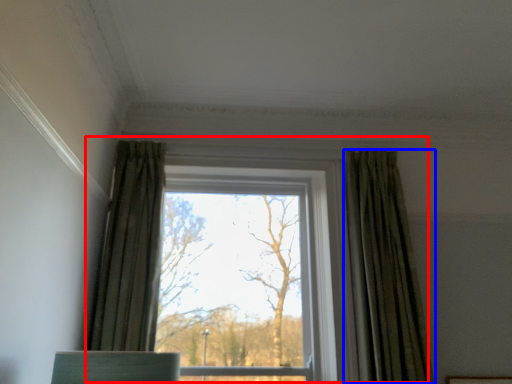
Question: Which object is closer to the camera taking this photo, window (highlighted by a red box) or curtain (highlighted by a blue box)?

Choices:
 (A) window
 (B) curtain

Answer: (B)